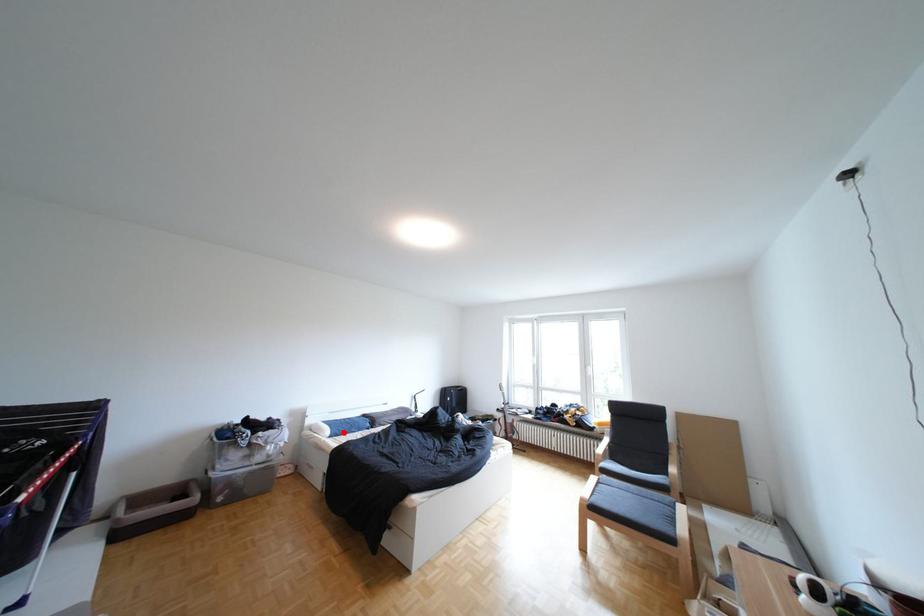
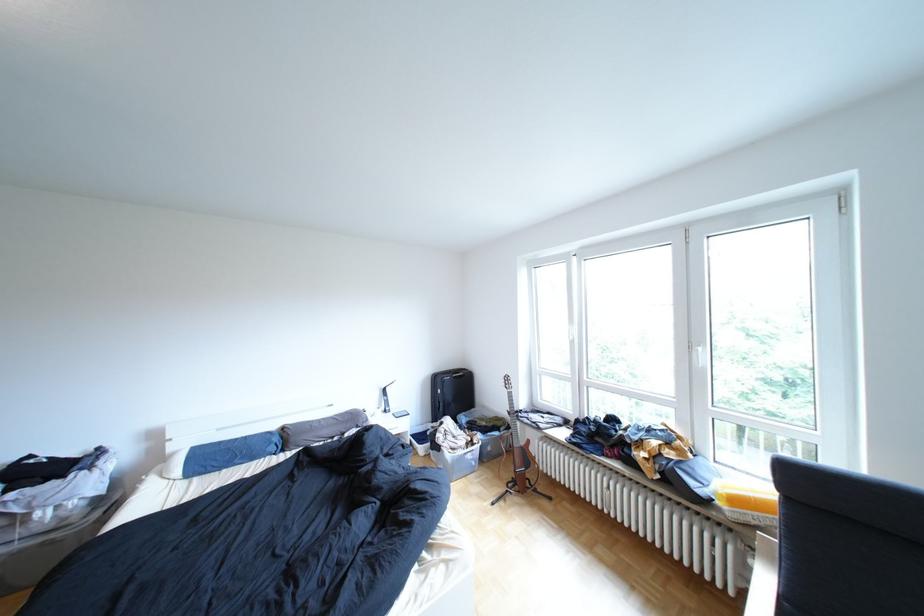
Find the pixel in the second image that matches the highlighted location in the first image.

(193, 472)